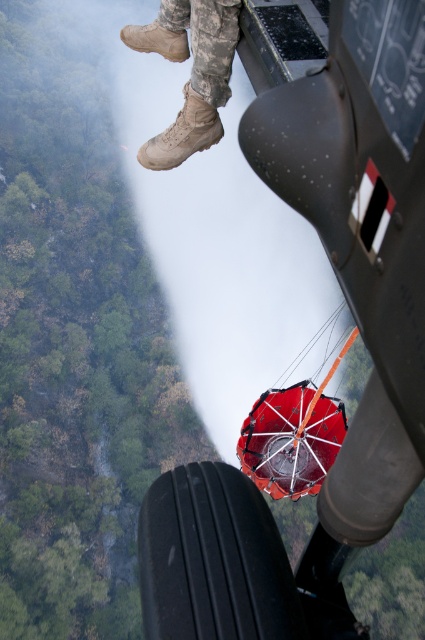
Between matte black aircraft at center and tan suede boots at upper center, which one is positioned higher?

Positioned higher is tan suede boots at upper center.

Find the location of a particular element. matte black aircraft at center is located at coordinates point(356,326).